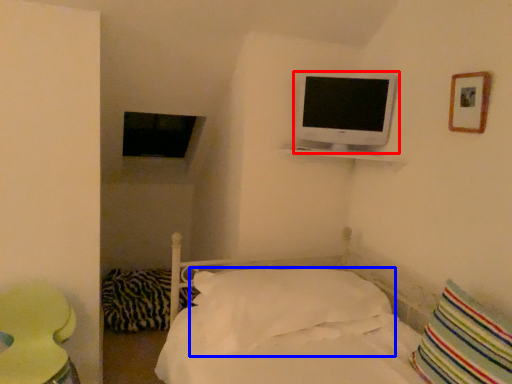
Question: Which of the following is the closest to the observer, television (highlighted by a red box) or pillow (highlighted by a blue box)?

Choices:
 (A) television
 (B) pillow

Answer: (B)